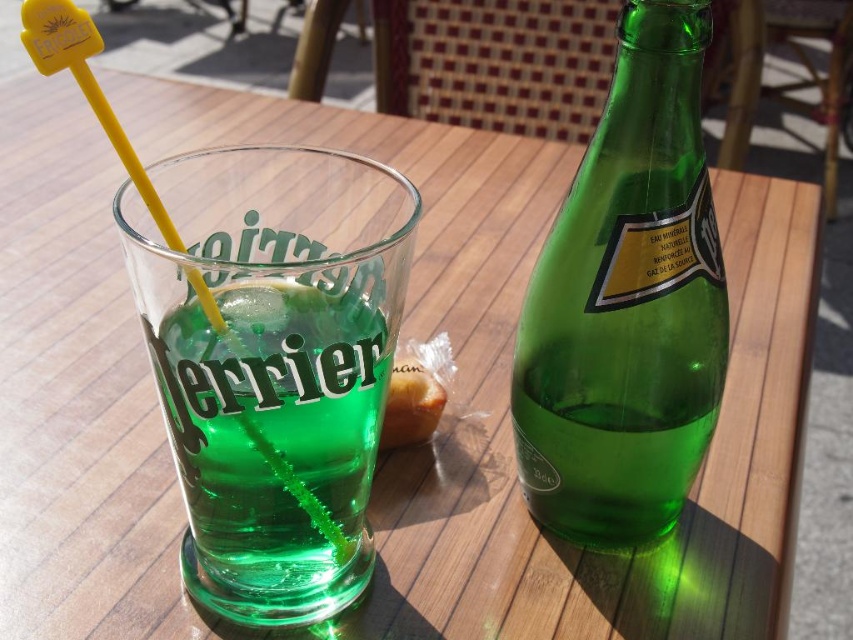
Question: Based on their relative distances, which object is farther from the green glass bottle at right?

Choices:
 (A) bread at center
 (B) green glass at center

Answer: (B)

Question: In this image, where is green glass at center located relative to bread at center?

Choices:
 (A) below
 (B) above

Answer: (A)

Question: Which of the following is the closest to the observer?

Choices:
 (A) green glass at center
 (B) green glass bottle at right
 (C) bread at center

Answer: (A)

Question: Is green glass bottle at right closer to the viewer compared to bread at center?

Choices:
 (A) no
 (B) yes

Answer: (B)

Question: Does green glass bottle at right appear over green glass at center?

Choices:
 (A) yes
 (B) no

Answer: (A)

Question: Which object appears closest to the camera in this image?

Choices:
 (A) green glass bottle at right
 (B) bread at center

Answer: (A)